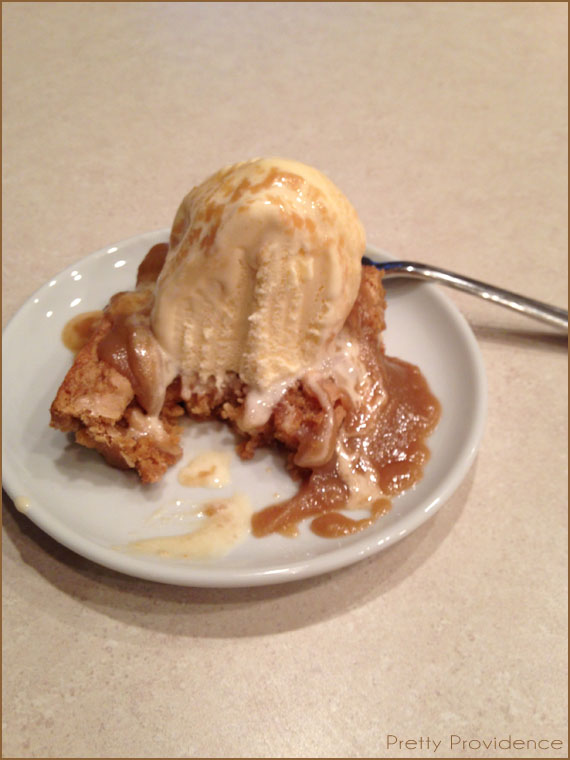
Identify the location of handle of fork/spoon. tap(492, 293).